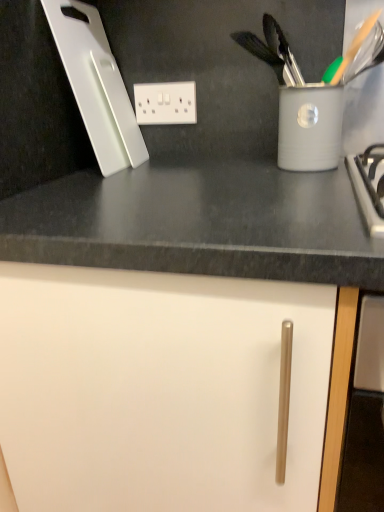
Question: Relative to white plastic cutting board at upper left, is white plastic electric outlet at upper center in front or behind?

Choices:
 (A) front
 (B) behind

Answer: (B)

Question: From a real-world perspective, is white plastic electric outlet at upper center physically located above or below white plastic cutting board at upper left?

Choices:
 (A) above
 (B) below

Answer: (B)

Question: Which object is the farthest from the white plastic cutting board at upper left?

Choices:
 (A) white plastic electric outlet at upper center
 (B) white matte cabinet door at center

Answer: (B)

Question: Considering the real-world distances, which object is closest to the white plastic electric outlet at upper center?

Choices:
 (A) white plastic cutting board at upper left
 (B) white matte cabinet door at center

Answer: (A)